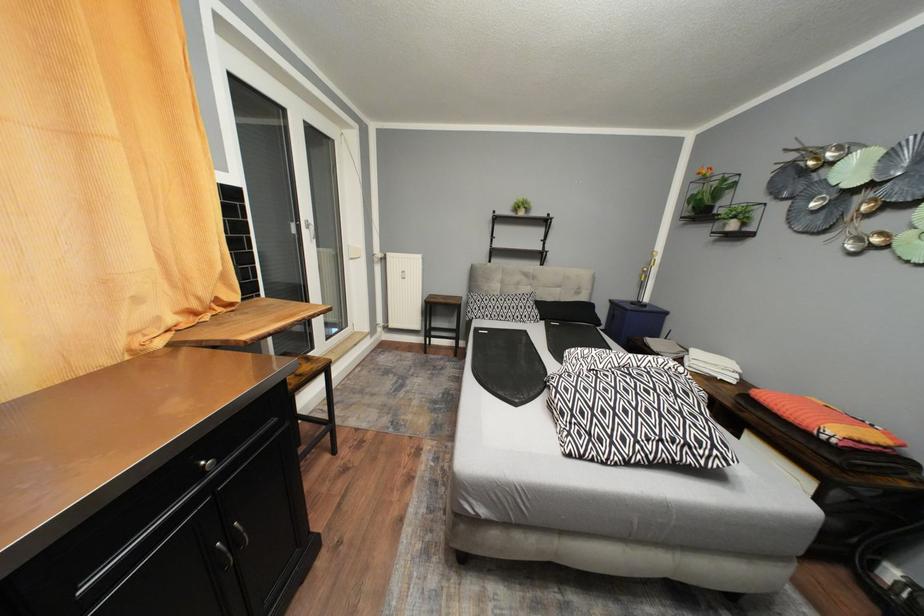
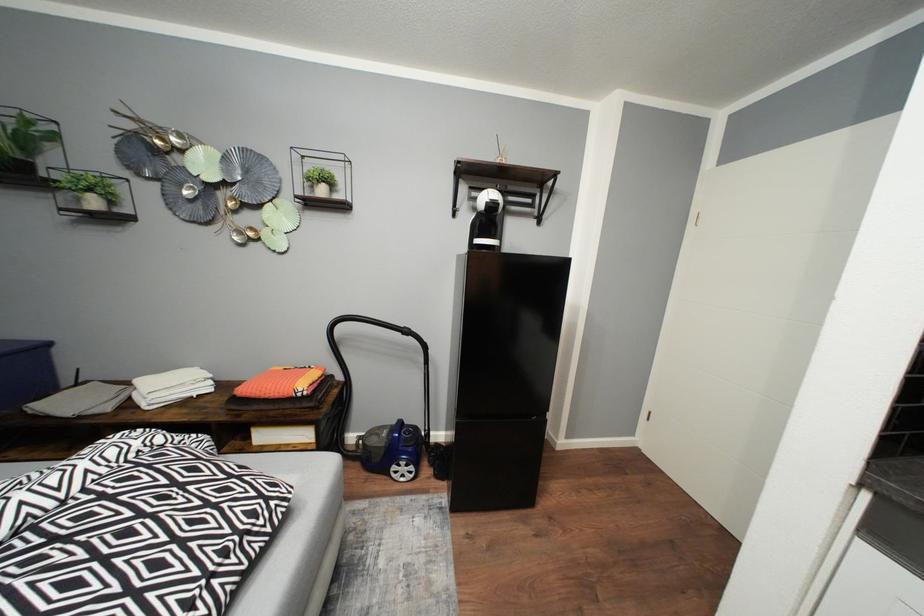
How did the camera likely rotate?

The rotation direction of the camera is right-down.